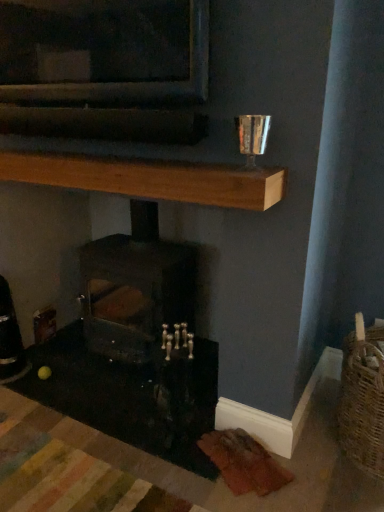
This screenshot has height=512, width=384. I want to click on wooden plank at upper center, so click(150, 179).

Describe the element at coordinates (150, 179) in the screenshot. This screenshot has width=384, height=512. I see `wooden plank at upper center` at that location.

This screenshot has width=384, height=512. What do you see at coordinates (135, 287) in the screenshot?
I see `dark gray stone wood burning stove at center` at bounding box center [135, 287].

Where is `dark gray stone wood burning stove at center`? dark gray stone wood burning stove at center is located at coordinates (135, 287).

Measure the distance between point (167, 272) and camera.

Point (167, 272) is 2.07 meters away from camera.

Locate an element on the screen. This screenshot has height=512, width=384. wooden plank at upper center is located at coordinates (150, 179).

Between dark gray stone wood burning stove at center and wooden plank at upper center, which one appears on the right side from the viewer's perspective?

dark gray stone wood burning stove at center is more to the right.

Is dark gray stone wood burning stove at center positioned before wooden plank at upper center?

No, the depth of dark gray stone wood burning stove at center is greater than that of wooden plank at upper center.

Between point (118, 343) and point (280, 191), which one is positioned behind?

The point (118, 343) is behind.

In the scene shown: From the image's perspective, is dark gray stone wood burning stove at center over wooden plank at upper center?

Incorrect, from the image's perspective, dark gray stone wood burning stove at center is lower than wooden plank at upper center.

Looking at this image, from a real-world perspective, is dark gray stone wood burning stove at center positioned under wooden plank at upper center based on gravity?

Yes, from a real-world perspective, dark gray stone wood burning stove at center is below wooden plank at upper center.

Does dark gray stone wood burning stove at center have a lesser width compared to wooden plank at upper center?

In fact, dark gray stone wood burning stove at center might be wider than wooden plank at upper center.

Is dark gray stone wood burning stove at center shorter than wooden plank at upper center?

No, dark gray stone wood burning stove at center is not shorter than wooden plank at upper center.

Between dark gray stone wood burning stove at center and wooden plank at upper center, which one has larger size?

Bigger between the two is dark gray stone wood burning stove at center.

Which is correct: dark gray stone wood burning stove at center is inside wooden plank at upper center, or outside of it?

dark gray stone wood burning stove at center cannot be found inside wooden plank at upper center.

Is dark gray stone wood burning stove at center next to wooden plank at upper center and touching it?

No, dark gray stone wood burning stove at center is not touching wooden plank at upper center.

Is dark gray stone wood burning stove at center looking in the opposite direction of wooden plank at upper center?

No, dark gray stone wood burning stove at center is not facing away from wooden plank at upper center.

Looking at this image, how distant is dark gray stone wood burning stove at center from wooden plank at upper center?

They are 68.69 centimeters apart.

In order to click on shelf located in front of the dark gray stone wood burning stove at center in this screenshot , I will do `click(150, 179)`.

Visually, is wooden plank at upper center positioned to the left or to the right of dark gray stone wood burning stove at center?

wooden plank at upper center is to the left of dark gray stone wood burning stove at center.

Is the position of wooden plank at upper center more distant than that of dark gray stone wood burning stove at center?

No, wooden plank at upper center is in front of dark gray stone wood burning stove at center.

Is point (25, 160) in front of point (129, 344)?

Yes, point (25, 160) is closer to viewer.

From the image's perspective, which one is positioned higher, wooden plank at upper center or dark gray stone wood burning stove at center?

wooden plank at upper center.

From a real-world perspective, is wooden plank at upper center over dark gray stone wood burning stove at center?

Yes, from a real-world perspective, wooden plank at upper center is above dark gray stone wood burning stove at center.

Between wooden plank at upper center and dark gray stone wood burning stove at center, which one has smaller width?

Thinner between the two is wooden plank at upper center.

Can you confirm if wooden plank at upper center is shorter than dark gray stone wood burning stove at center?

Yes.

Looking at the image, does wooden plank at upper center seem bigger or smaller compared to dark gray stone wood burning stove at center?

In the image, wooden plank at upper center appears to be smaller than dark gray stone wood burning stove at center.

Is wooden plank at upper center positioned beyond the bounds of dark gray stone wood burning stove at center?

Yes, wooden plank at upper center is outside of dark gray stone wood burning stove at center.

Is the surface of wooden plank at upper center in direct contact with dark gray stone wood burning stove at center?

No.

Is wooden plank at upper center facing away from dark gray stone wood burning stove at center?

No, wooden plank at upper center is not facing away from dark gray stone wood burning stove at center.

What's the angular difference between wooden plank at upper center and dark gray stone wood burning stove at center's facing directions?

The facing directions of wooden plank at upper center and dark gray stone wood burning stove at center are 0.102 degrees apart.

Where is `wood burning stove that is below the wooden plank at upper center (from the image's perspective)`? The height and width of the screenshot is (512, 384). wood burning stove that is below the wooden plank at upper center (from the image's perspective) is located at coordinates (135, 287).

This screenshot has width=384, height=512. Identify the location of wood burning stove located on the right of wooden plank at upper center. tap(135, 287).

I want to click on shelf above the dark gray stone wood burning stove at center (from the image's perspective), so click(x=150, y=179).